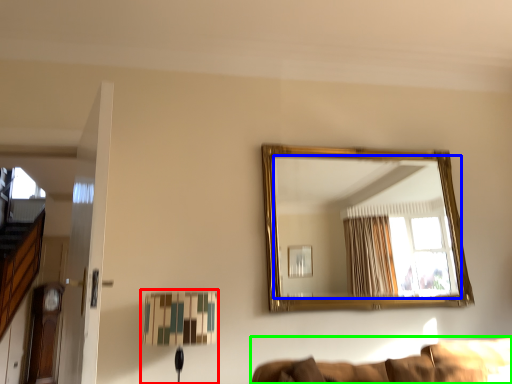
Question: Based on their relative distances, which object is nearer to table lamp (highlighted by a red box)? Choose from mirror (highlighted by a blue box) and couch (highlighted by a green box).

Choices:
 (A) mirror
 (B) couch

Answer: (B)